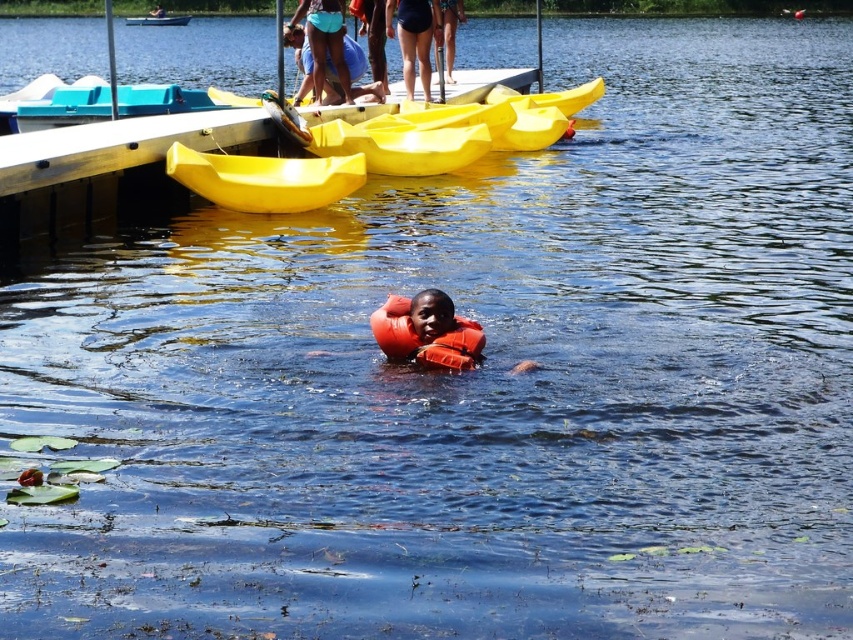
You are standing at the edge of the lake and see two points marked in the scene. Which of the two points, point (430, 346) or point (428, 70), is closer to you?

Point (430, 346) is closer to the viewer than point (428, 70).

You are a photographer trying to capture a photo of the yellow matte kayak at upper center and the blue denim shorts at upper center. Since you want both subjects in the frame, which one should you focus on first to ensure the kayak is visible behind the shorts?

The yellow matte kayak at upper center is positioned under the blue denim shorts at upper center, so you should focus on the blue denim shorts at upper center first to ensure the kayak is visible behind it.